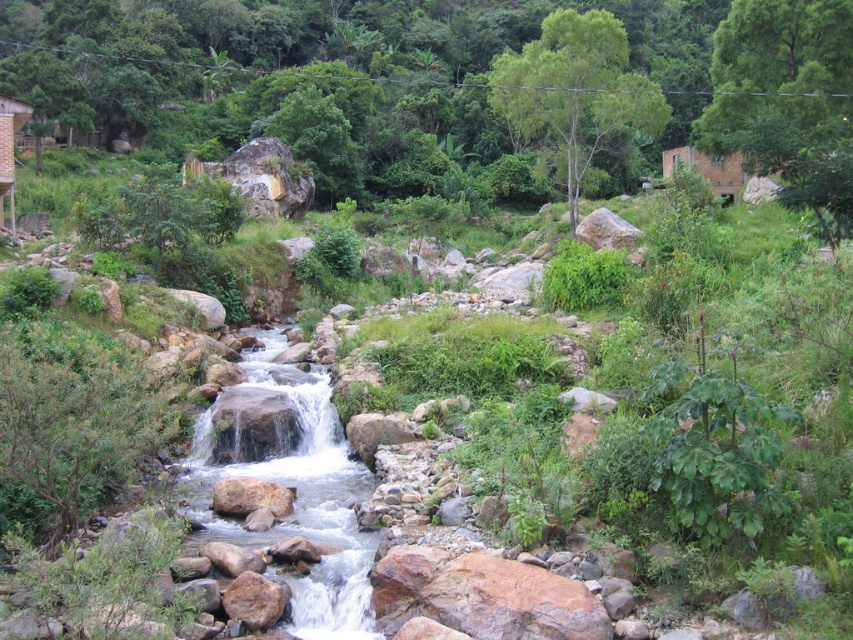
Does point (346, 488) come behind point (20, 120)?

No, it is in front of (20, 120).

Can you confirm if smooth rock stream at center is positioned below wooden hut at upper left?

Yes.

Locate an element on the screen. Image resolution: width=853 pixels, height=640 pixels. smooth rock stream at center is located at coordinates (297, 500).

Locate an element on the screen. The width and height of the screenshot is (853, 640). smooth rock stream at center is located at coordinates (297, 500).